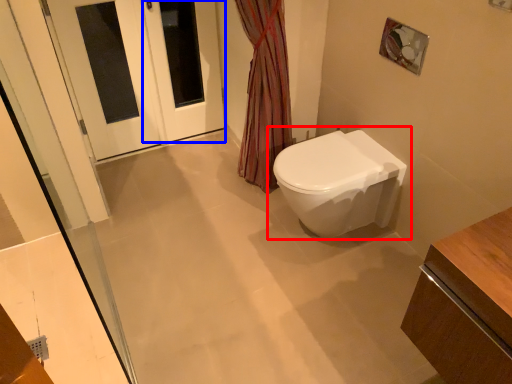
Question: Among these objects, which one is nearest to the camera, toilet (highlighted by a red box) or screen door (highlighted by a blue box)?

Choices:
 (A) toilet
 (B) screen door

Answer: (A)